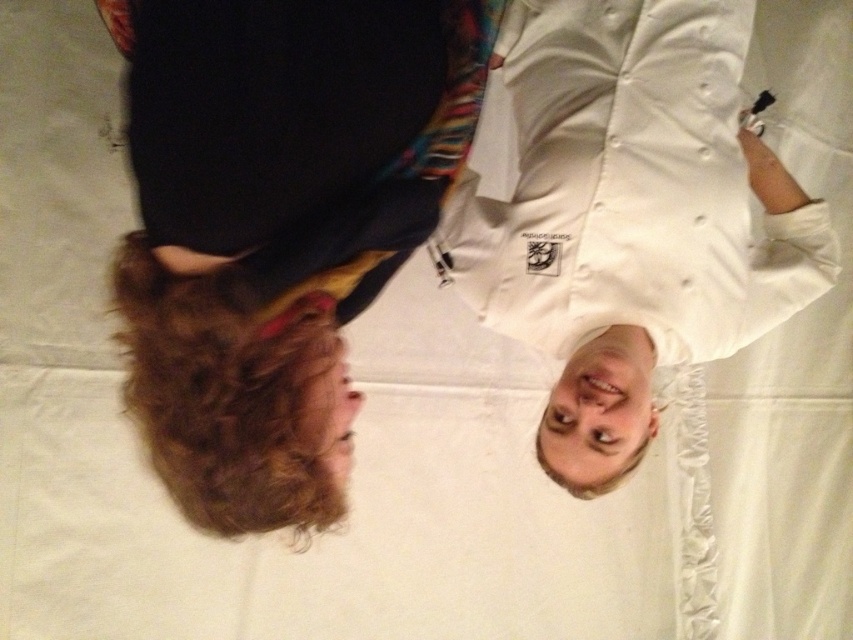
Question: Does dark brown curly hair at left appear on the right side of white matte chef's coat at upper right?

Choices:
 (A) yes
 (B) no

Answer: (B)

Question: Which point is closer to the camera?

Choices:
 (A) dark brown curly hair at left
 (B) white matte chef's coat at upper right

Answer: (A)

Question: Which object is closer to the camera taking this photo?

Choices:
 (A) white matte chef's coat at upper right
 (B) dark brown curly hair at left

Answer: (B)

Question: From the image, what is the correct spatial relationship of dark brown curly hair at left in relation to white matte chef's coat at upper right?

Choices:
 (A) right
 (B) left

Answer: (B)

Question: Can you confirm if dark brown curly hair at left is positioned to the left of white matte chef's coat at upper right?

Choices:
 (A) yes
 (B) no

Answer: (A)